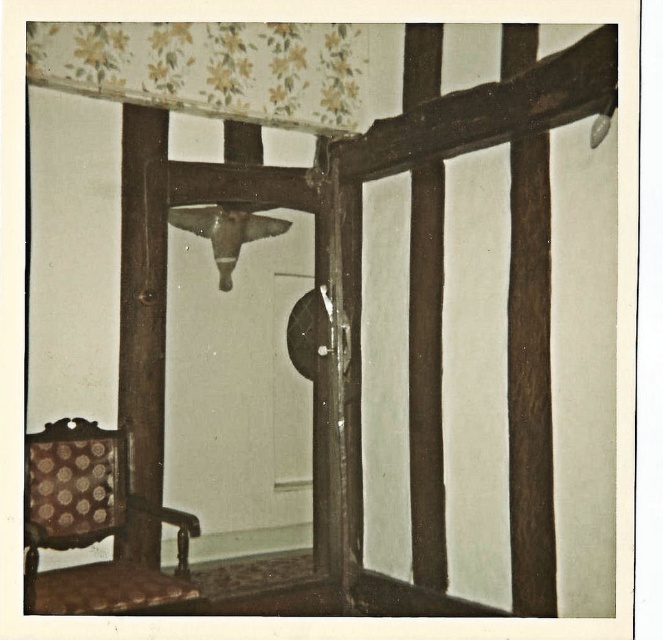
Is floral wallpaper at upper center positioned in front of dark brown wood at center?

No, it is behind dark brown wood at center.

What do you see at coordinates (211, 68) in the screenshot? I see `floral wallpaper at upper center` at bounding box center [211, 68].

Who is more forward, (330, 131) or (522, 173)?

Point (522, 173) is more forward.

Where is `floral wallpaper at upper center`? floral wallpaper at upper center is located at coordinates (211, 68).

Does floral wallpaper at upper center have a smaller size compared to patterned fabric chair at lower left?

No.

Is point (38, 60) positioned in front of point (117, 608)?

No.

The image size is (663, 640). In order to click on floral wallpaper at upper center in this screenshot , I will do [x=211, y=68].

Image resolution: width=663 pixels, height=640 pixels. Describe the element at coordinates (211, 68) in the screenshot. I see `floral wallpaper at upper center` at that location.

Image resolution: width=663 pixels, height=640 pixels. Describe the element at coordinates (211, 68) in the screenshot. I see `floral wallpaper at upper center` at that location.

Where is `floral wallpaper at upper center`? floral wallpaper at upper center is located at coordinates (211, 68).